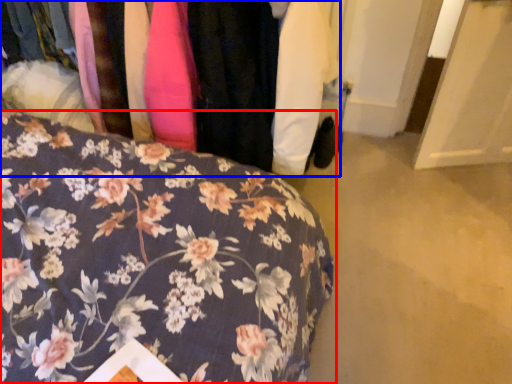
Question: Which of the following is the farthest to the observer, furniture (highlighted by a red box) or closet (highlighted by a blue box)?

Choices:
 (A) furniture
 (B) closet

Answer: (B)